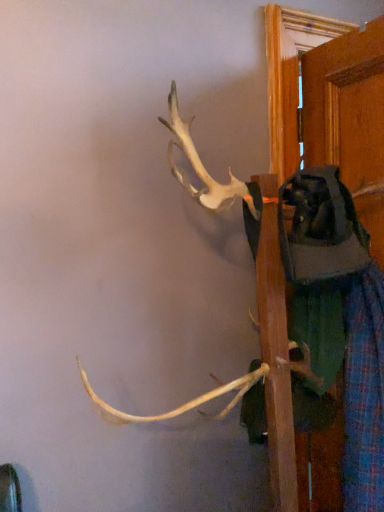
Question: Should I look upward or downward to see plaid fabric pants at right?

Choices:
 (A) up
 (B) down

Answer: (B)

Question: Is plaid fabric pants at right positioned in front of wooden door at right?

Choices:
 (A) no
 (B) yes

Answer: (B)

Question: From a real-world perspective, is plaid fabric pants at right below wooden door at right?

Choices:
 (A) yes
 (B) no

Answer: (A)

Question: Does plaid fabric pants at right have a larger size compared to wooden door at right?

Choices:
 (A) yes
 (B) no

Answer: (A)

Question: Does plaid fabric pants at right have a greater height compared to wooden door at right?

Choices:
 (A) yes
 (B) no

Answer: (B)

Question: Is the position of plaid fabric pants at right more distant than that of wooden door at right?

Choices:
 (A) no
 (B) yes

Answer: (A)

Question: Is plaid fabric pants at right to the right of wooden door at right from the viewer's perspective?

Choices:
 (A) no
 (B) yes

Answer: (A)

Question: Is wooden door at right behind plaid fabric pants at right?

Choices:
 (A) yes
 (B) no

Answer: (A)

Question: Considering the relative positions of wooden door at right and plaid fabric pants at right in the image provided, is wooden door at right to the left of plaid fabric pants at right from the viewer's perspective?

Choices:
 (A) yes
 (B) no

Answer: (B)

Question: From the image's perspective, is wooden door at right above plaid fabric pants at right?

Choices:
 (A) yes
 (B) no

Answer: (A)

Question: Is wooden door at right wider than plaid fabric pants at right?

Choices:
 (A) no
 (B) yes

Answer: (A)

Question: Does wooden door at right have a lesser width compared to plaid fabric pants at right?

Choices:
 (A) yes
 (B) no

Answer: (A)

Question: From a real-world perspective, is wooden door at right on plaid fabric pants at right?

Choices:
 (A) yes
 (B) no

Answer: (A)

Question: In the image, is plaid fabric pants at right on the left side or the right side of wooden door at right?

Choices:
 (A) left
 (B) right

Answer: (A)